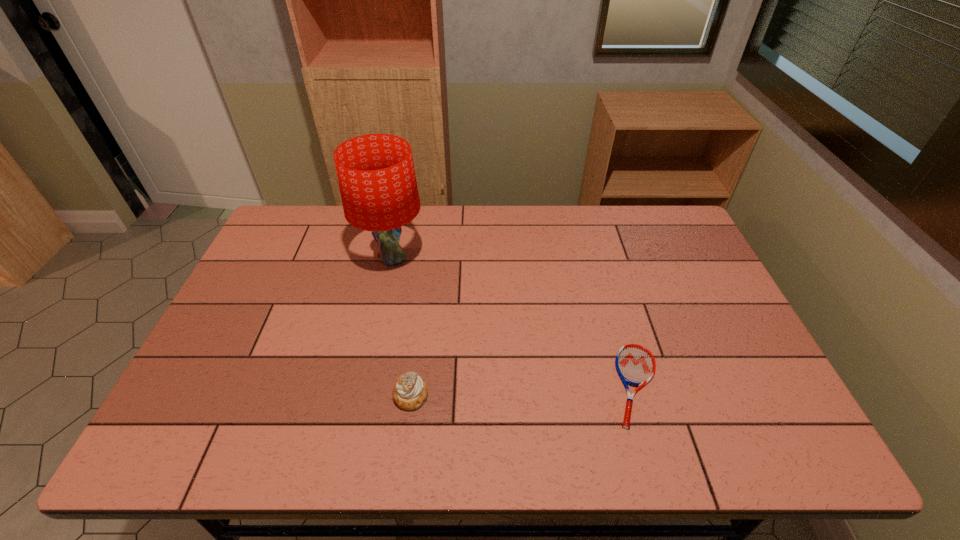
Identify the location of free space at the far edge of the desktop. [x=558, y=220].

In the image, there is a desktop. At what (x,y) coordinates should I click in order to perform the action: click on vacant space at the near edge. Please return your answer as a coordinate pair (x, y). The height and width of the screenshot is (540, 960). Looking at the image, I should click on (x=274, y=424).

In the image, there is a desktop. Identify the location of vacant space at the left edge. (280, 258).

Find the location of a particular element. vacant space at the right edge of the desktop is located at coordinates (698, 324).

The width and height of the screenshot is (960, 540). I want to click on unoccupied position between the lampshade and the second shortest object, so click(401, 327).

Locate an element on the screen. free space between the rightmost object and the tallest object is located at coordinates (514, 322).

Identify the location of vacant space that is in between the pastry and the farthest object. Image resolution: width=960 pixels, height=540 pixels. (401, 327).

You are a GUI agent. You are given a task and a screenshot of the screen. Output one action in this format:
    pyautogui.click(x=<x>, y=<y>)
    Task: Click on the free space between the tennis racket and the lampshade
    
    Given the screenshot: What is the action you would take?
    pyautogui.click(x=514, y=322)

Where is `vacant area between the tennis racket and the pastry`? The height and width of the screenshot is (540, 960). vacant area between the tennis racket and the pastry is located at coordinates (523, 390).

Locate an element on the screen. The image size is (960, 540). vacant space that's between the second shortest object and the farthest object is located at coordinates (401, 327).